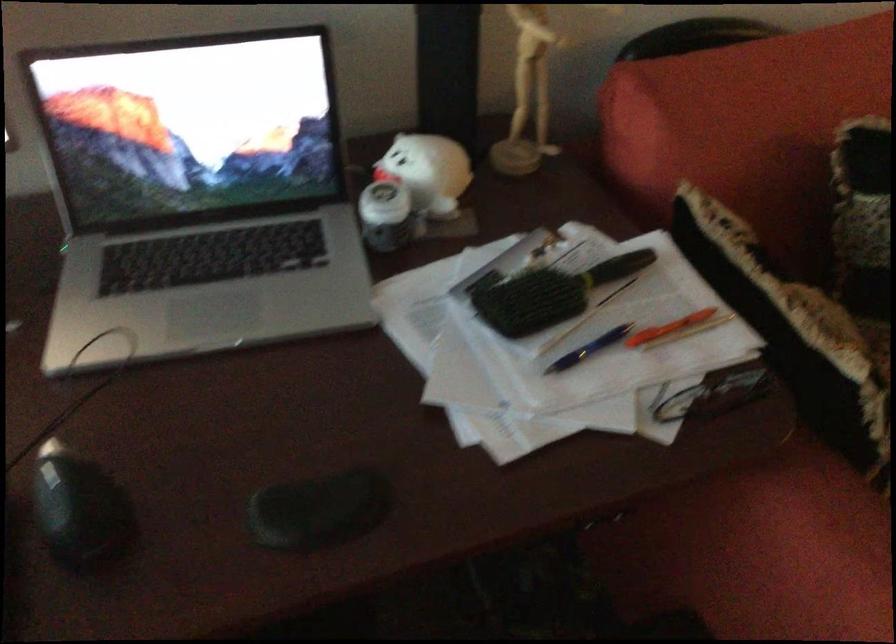
Locate an element on the screen. The height and width of the screenshot is (644, 896). blue pen is located at coordinates (589, 348).